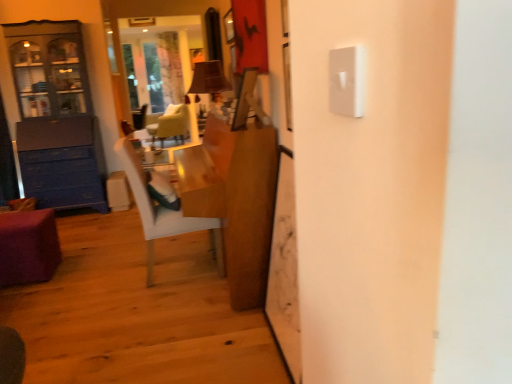
Question: Is wooden desk at center not within white textured curtain at upper center?

Choices:
 (A) no
 (B) yes

Answer: (B)

Question: Does wooden desk at center appear on the left side of white textured curtain at upper center?

Choices:
 (A) yes
 (B) no

Answer: (B)

Question: Is wooden desk at center far away from white textured curtain at upper center?

Choices:
 (A) yes
 (B) no

Answer: (A)

Question: Can you confirm if wooden desk at center is taller than white textured curtain at upper center?

Choices:
 (A) no
 (B) yes

Answer: (A)

Question: Can you confirm if wooden desk at center is wider than white textured curtain at upper center?

Choices:
 (A) no
 (B) yes

Answer: (B)

Question: Is purple fabric ottoman at lower left bigger or smaller than light green fabric chair at center, the first chair in the back-to-front sequence?

Choices:
 (A) small
 (B) big

Answer: (A)

Question: In terms of width, does purple fabric ottoman at lower left look wider or thinner when compared to light green fabric chair at center, which ranks as the 1th chair in top-to-bottom order?

Choices:
 (A) wide
 (B) thin

Answer: (B)

Question: Considering the positions of point (23, 233) and point (180, 112), is point (23, 233) closer or farther from the camera than point (180, 112)?

Choices:
 (A) closer
 (B) farther

Answer: (A)

Question: From the image's perspective, is purple fabric ottoman at lower left positioned above or below light green fabric chair at center, the first chair in the back-to-front sequence?

Choices:
 (A) below
 (B) above

Answer: (A)

Question: Considering the relative positions of wooden desk at center and light green fabric chair at center, the second chair when ordered from bottom to top, in the image provided, is wooden desk at center to the left or to the right of light green fabric chair at center, the second chair when ordered from bottom to top,?

Choices:
 (A) right
 (B) left

Answer: (A)

Question: From their relative heights in the image, would you say wooden desk at center is taller or shorter than light green fabric chair at center, the first chair from the left?

Choices:
 (A) tall
 (B) short

Answer: (A)

Question: From the image's perspective, relative to light green fabric chair at center, which ranks as the 1th chair in top-to-bottom order, is wooden desk at center above or below?

Choices:
 (A) above
 (B) below

Answer: (B)

Question: Is wooden desk at center inside the boundaries of light green fabric chair at center, acting as the 2th chair starting from the front, or outside?

Choices:
 (A) inside
 (B) outside

Answer: (B)

Question: In terms of width, does light green fabric chair at center, the first chair from the left, look wider or thinner when compared to white glossy chair at center, the second chair viewed from the top?

Choices:
 (A) thin
 (B) wide

Answer: (B)

Question: Visually, is light green fabric chair at center, acting as the 2th chair starting from the front, positioned to the left or to the right of white glossy chair at center, the first chair in the front-to-back sequence?

Choices:
 (A) left
 (B) right

Answer: (A)